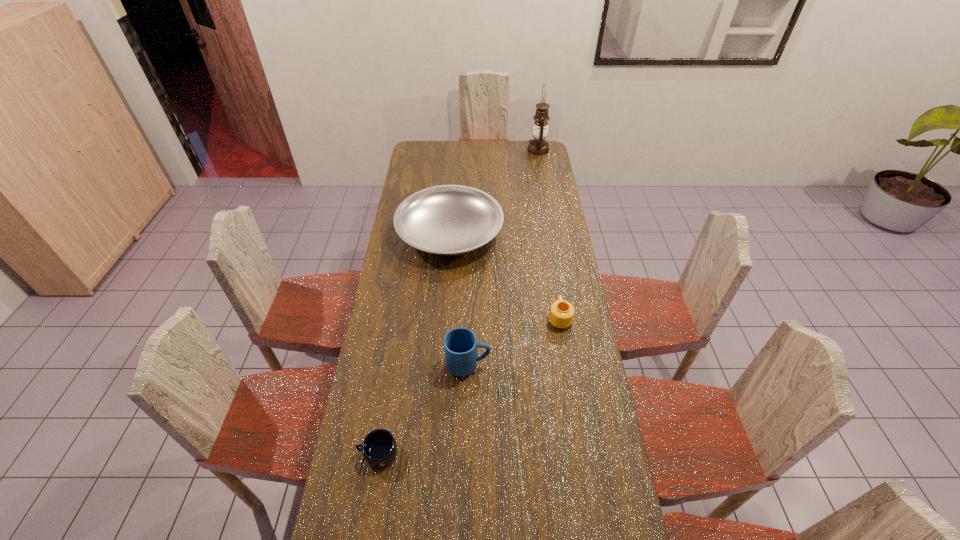
At what (x,y) coordinates should I click in order to perform the action: click on free space between the nearest object and the rightmost mug. Please return your answer as a coordinate pair (x, y). The height and width of the screenshot is (540, 960). Looking at the image, I should click on (468, 386).

At what (x,y) coordinates should I click in order to perform the action: click on vacant region between the farthest object and the bedpan. Please return your answer as a coordinate pair (x, y). The height and width of the screenshot is (540, 960). Looking at the image, I should click on (494, 191).

Identify the location of free spot between the second tallest mug and the farthest object. The height and width of the screenshot is (540, 960). (549, 234).

At what (x,y) coordinates should I click in order to perform the action: click on vacant space that is in between the tallest object and the nearest object. Please return your answer as a coordinate pair (x, y). Image resolution: width=960 pixels, height=540 pixels. Looking at the image, I should click on (458, 301).

The image size is (960, 540). Find the location of `vacant area that lies between the second nearest object and the bedpan`. vacant area that lies between the second nearest object and the bedpan is located at coordinates (459, 299).

The width and height of the screenshot is (960, 540). Identify the location of the third closest object to the second farthest object. (538, 146).

Select which object appears as the fourth closest to the nearest object. Please provide its 2D coordinates. Your answer should be formatted as a tuple, i.e. [(x, y)], where the tuple contains the x and y coordinates of a point satisfying the conditions above.

[(538, 146)]

Identify the location of mug that stands as the second closest to the second farthest object. The width and height of the screenshot is (960, 540). (460, 345).

Locate an element on the screen. Image resolution: width=960 pixels, height=540 pixels. the second closest mug to the third farthest object is located at coordinates (379, 448).

Find the location of a particular element. This screenshot has height=540, width=960. free spot that satisfies the following two spatial constraints: 1. on the handle side of the third farthest object; 2. on the right side of the tallest object is located at coordinates point(533,150).